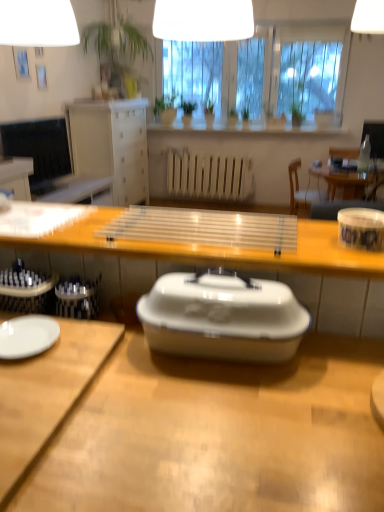
Question: From the image's perspective, does white glossy mug at right appear higher than white glossy lampshade at upper center?

Choices:
 (A) no
 (B) yes

Answer: (A)

Question: Is white glossy mug at right taller than white glossy lampshade at upper center?

Choices:
 (A) no
 (B) yes

Answer: (A)

Question: Can you confirm if white glossy mug at right is positioned to the right of white glossy lampshade at upper center?

Choices:
 (A) yes
 (B) no

Answer: (A)

Question: Can you confirm if white glossy mug at right is thinner than white glossy lampshade at upper center?

Choices:
 (A) no
 (B) yes

Answer: (B)

Question: From a real-world perspective, is white glossy mug at right on white glossy lampshade at upper center?

Choices:
 (A) no
 (B) yes

Answer: (A)

Question: Is white glossy mug at right looking in the opposite direction of white glossy lampshade at upper center?

Choices:
 (A) yes
 (B) no

Answer: (A)

Question: Considering the relative sizes of white glossy sink at center and matte white vase at upper center in the image provided, is white glossy sink at center thinner than matte white vase at upper center?

Choices:
 (A) yes
 (B) no

Answer: (A)

Question: Is white glossy sink at center positioned behind matte white vase at upper center?

Choices:
 (A) no
 (B) yes

Answer: (A)

Question: Does white glossy sink at center have a lesser height compared to matte white vase at upper center?

Choices:
 (A) yes
 (B) no

Answer: (A)

Question: Is white glossy sink at center facing away from matte white vase at upper center?

Choices:
 (A) no
 (B) yes

Answer: (B)

Question: From a real-world perspective, is white glossy sink at center on top of matte white vase at upper center?

Choices:
 (A) no
 (B) yes

Answer: (A)

Question: Is white glossy sink at center taller than matte white vase at upper center?

Choices:
 (A) no
 (B) yes

Answer: (A)

Question: Is green matte plant at center, which is the 4th houseplant from right to left, bigger than green leafy plant at center, which ranks as the 5th houseplant in left-to-right order?

Choices:
 (A) no
 (B) yes

Answer: (B)